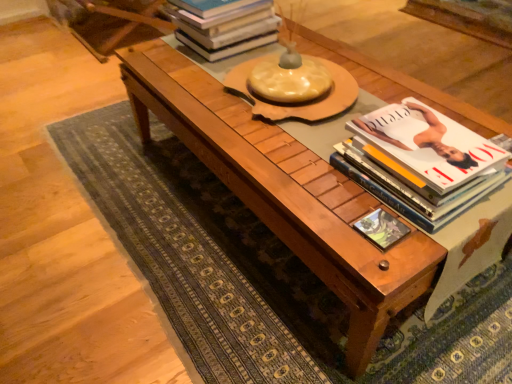
Locate an element on the screen. The image size is (512, 384). wooden coffee table at center is located at coordinates (284, 191).

Measure the distance between matte green book at center and camera.

The distance of matte green book at center from camera is 85.53 centimeters.

You are a GUI agent. You are given a task and a screenshot of the screen. Output one action in this format:
    pyautogui.click(x=<x>, y=<y>)
    Task: Click on the hardcover books at upper center, which is counted as the 1th book, starting from the left
    The width and height of the screenshot is (512, 384).
    Given the screenshot: What is the action you would take?
    pyautogui.click(x=223, y=26)

Is point (398, 234) farther from camera compared to point (252, 27)?

No, (398, 234) is closer to viewer.

Measure the distance between matte green book at center and hardcover books at upper center, which ranks as the first book in back-to-front order.

matte green book at center and hardcover books at upper center, which ranks as the first book in back-to-front order, are 37.75 inches apart.

Would you say matte green book at center is outside hardcover books at upper center, which is the 1th book in top-to-bottom order?

Yes, matte green book at center is not within hardcover books at upper center, which is the 1th book in top-to-bottom order.

Considering the sizes of matte green book at center and hardcover books at upper center, marked as the second book in a bottom-to-top arrangement, in the image, is matte green book at center taller or shorter than hardcover books at upper center, marked as the second book in a bottom-to-top arrangement,?

Considering their sizes, matte green book at center has less height than hardcover books at upper center, marked as the second book in a bottom-to-top arrangement.

Which is correct: white glossy book at right, the 2th book from the top, is inside hardcover books at upper center, marked as the second book in a bottom-to-top arrangement, or outside of it?

white glossy book at right, the 2th book from the top, is not inside hardcover books at upper center, marked as the second book in a bottom-to-top arrangement, it's outside.

At what (x,y) coordinates should I click in order to perform the action: click on book in front of the hardcover books at upper center, which ranks as the first book in back-to-front order. Please return your answer as a coordinate pair (x, y). Looking at the image, I should click on (415, 162).

Measure the distance from white glossy book at right, the first book positioned from the right, to hardcover books at upper center, positioned as the 2th book in right-to-left order.

white glossy book at right, the first book positioned from the right, is 30.93 inches away from hardcover books at upper center, positioned as the 2th book in right-to-left order.

Between white glossy book at right, the 2th book from the top, and hardcover books at upper center, marked as the second book in a bottom-to-top arrangement, which one has larger size?

hardcover books at upper center, marked as the second book in a bottom-to-top arrangement.

Where is `book cover above the wooden coffee table at center (from a real-world perspective)`? The height and width of the screenshot is (384, 512). book cover above the wooden coffee table at center (from a real-world perspective) is located at coordinates (381, 228).

Is matte green book at center not near wooden coffee table at center?

No, matte green book at center is not far from wooden coffee table at center.

Can you tell me how much matte green book at center and wooden coffee table at center differ in facing direction?

180 degrees separate the facing orientations of matte green book at center and wooden coffee table at center.

From the image's perspective, is matte green book at center located above or below wooden coffee table at center?

From the image's perspective, matte green book at center appears below wooden coffee table at center.

Consider the image. Looking at their sizes, would you say white glossy book at right, which is the 1th book from bottom to top, is wider or thinner than matte green book at center?

Considering their sizes, white glossy book at right, which is the 1th book from bottom to top, looks broader than matte green book at center.

The image size is (512, 384). I want to click on book cover located below the white glossy book at right, positioned as the second book in left-to-right order (from the image's perspective), so click(381, 228).

Is point (333, 161) less distant than point (383, 223)?

No, (333, 161) is behind (383, 223).

Is white glossy book at right, the first book positioned from the right, behind matte green book at center?

No, white glossy book at right, the first book positioned from the right, is closer to the viewer.

Is point (436, 218) positioned behind point (303, 250)?

No, (436, 218) is in front of (303, 250).

From the image's perspective, is white glossy book at right, which is counted as the 1th book, starting from the front, above or below wooden coffee table at center?

Clearly, from the image's perspective, white glossy book at right, which is counted as the 1th book, starting from the front, is below wooden coffee table at center.

Which of these two, white glossy book at right, the first book positioned from the right, or wooden coffee table at center, stands shorter?

With less height is white glossy book at right, the first book positioned from the right.

Where is `table directly beneath the white glossy book at right, which is the 1th book from bottom to top (from a real-world perspective)`? table directly beneath the white glossy book at right, which is the 1th book from bottom to top (from a real-world perspective) is located at coordinates (284, 191).

Can you confirm if hardcover books at upper center, positioned as the 2th book in right-to-left order, is smaller than matte green book at center?

Actually, hardcover books at upper center, positioned as the 2th book in right-to-left order, might be larger than matte green book at center.

Does hardcover books at upper center, marked as the second book in a bottom-to-top arrangement, come in front of matte green book at center?

That is False.

Considering the sizes of hardcover books at upper center, which ranks as the first book in back-to-front order, and matte green book at center in the image, is hardcover books at upper center, which ranks as the first book in back-to-front order, taller or shorter than matte green book at center?

In the image, hardcover books at upper center, which ranks as the first book in back-to-front order, appears to be taller than matte green book at center.

Considering the relative sizes of hardcover books at upper center, which is the 1th book in top-to-bottom order, and matte green book at center in the image provided, is hardcover books at upper center, which is the 1th book in top-to-bottom order, thinner than matte green book at center?

In fact, hardcover books at upper center, which is the 1th book in top-to-bottom order, might be wider than matte green book at center.

Which object is further away from the camera, hardcover books at upper center, marked as the second book in a bottom-to-top arrangement, or white glossy book at right, positioned as the second book in left-to-right order?

hardcover books at upper center, marked as the second book in a bottom-to-top arrangement, is behind.

From the image's perspective, is hardcover books at upper center, acting as the second book starting from the front, located above or below white glossy book at right, which is counted as the 1th book, starting from the front?

Clearly, from the image's perspective, hardcover books at upper center, acting as the second book starting from the front, is above white glossy book at right, which is counted as the 1th book, starting from the front.

In the image, there is a hardcover books at upper center, positioned as the 2th book in right-to-left order. Identify the location of book below it (from the image's perspective). The width and height of the screenshot is (512, 384). (415, 162).

From a real-world perspective, is hardcover books at upper center, which is counted as the 1th book, starting from the left, beneath white glossy book at right, positioned as the second book in left-to-right order?

No, from a real-world perspective, hardcover books at upper center, which is counted as the 1th book, starting from the left, is not under white glossy book at right, positioned as the second book in left-to-right order.

I want to click on book cover located below the hardcover books at upper center, positioned as the 2th book in right-to-left order (from the image's perspective), so click(381, 228).

What are the coordinates of `book located in front of the hardcover books at upper center, acting as the second book starting from the front` in the screenshot? It's located at (415, 162).

From the image, which object appears to be nearer to hardcover books at upper center, which ranks as the first book in back-to-front order, matte green book at center or white glossy book at right, the 2th book from the top?

The object closer to hardcover books at upper center, which ranks as the first book in back-to-front order, is white glossy book at right, the 2th book from the top.

From the image, which object appears to be farther from white glossy book at right, positioned as the second book in left-to-right order, hardcover books at upper center, acting as the second book starting from the front, or matte green book at center?

hardcover books at upper center, acting as the second book starting from the front, lies further to white glossy book at right, positioned as the second book in left-to-right order, than the other object.

Looking at the image, which one is located closer to matte green book at center, white glossy book at right, the first book positioned from the right, or hardcover books at upper center, which is counted as the 1th book, starting from the left?

white glossy book at right, the first book positioned from the right, lies closer to matte green book at center than the other object.

When comparing their distances from white glossy book at right, the first book positioned from the right, does wooden coffee table at center or matte green book at center seem further?

wooden coffee table at center lies further to white glossy book at right, the first book positioned from the right, than the other object.

Based on their spatial positions, is white glossy book at right, which is counted as the 1th book, starting from the front, or matte green book at center closer to wooden coffee table at center?

white glossy book at right, which is counted as the 1th book, starting from the front, is closer to wooden coffee table at center.

From the image, which object appears to be nearer to white glossy book at right, which is the 1th book from bottom to top, wooden coffee table at center or hardcover books at upper center, acting as the second book starting from the front?

Among the two, wooden coffee table at center is located nearer to white glossy book at right, which is the 1th book from bottom to top.

Estimate the real-world distances between objects in this image. Which object is further from matte green book at center, wooden coffee table at center or hardcover books at upper center, positioned as the 2th book in right-to-left order?

hardcover books at upper center, positioned as the 2th book in right-to-left order, is positioned further to the anchor matte green book at center.

From the picture: From the image, which object appears to be nearer to hardcover books at upper center, positioned as the 2th book in right-to-left order, white glossy book at right, which is the 2th book in back-to-front order, or matte green book at center?

Among the two, white glossy book at right, which is the 2th book in back-to-front order, is located nearer to hardcover books at upper center, positioned as the 2th book in right-to-left order.

This screenshot has height=384, width=512. Identify the location of book between hardcover books at upper center, acting as the second book starting from the front, and matte green book at center vertically. (415, 162).

Where is `table between hardcover books at upper center, which ranks as the first book in back-to-front order, and matte green book at center, in the vertical direction`? The height and width of the screenshot is (384, 512). table between hardcover books at upper center, which ranks as the first book in back-to-front order, and matte green book at center, in the vertical direction is located at coordinates (284, 191).

Where is `book between wooden coffee table at center and hardcover books at upper center, which is the 1th book in top-to-bottom order, from front to back`? book between wooden coffee table at center and hardcover books at upper center, which is the 1th book in top-to-bottom order, from front to back is located at coordinates (415, 162).

The width and height of the screenshot is (512, 384). I want to click on book cover situated between wooden coffee table at center and white glossy book at right, the 2th book from the top, from left to right, so click(381, 228).